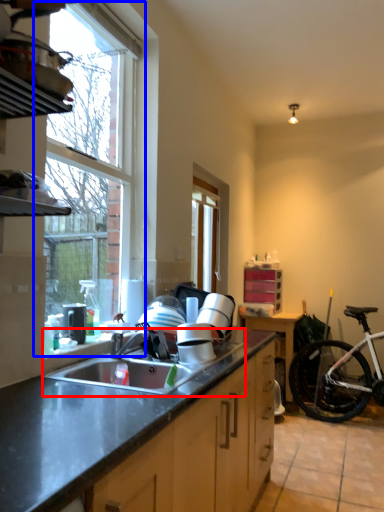
Question: Which object is further to the camera taking this photo, sink (highlighted by a red box) or window (highlighted by a blue box)?

Choices:
 (A) sink
 (B) window

Answer: (B)